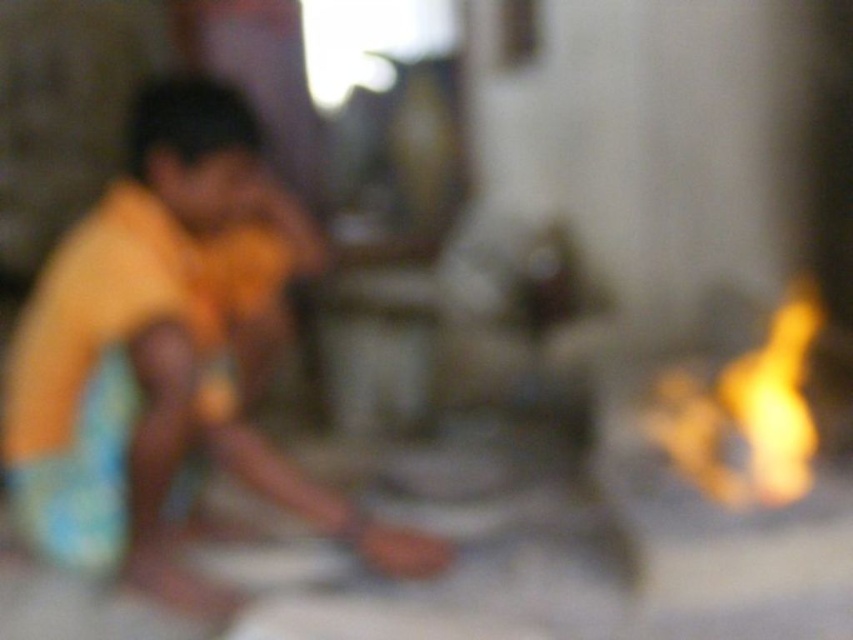
You are standing in the scene and need to locate the yellow cotton shirt at left. Based on its coordinates, where should you look relative to the center of the image?

The yellow cotton shirt at left is located at coordinates point (166, 356), which is to the left and slightly below the center of the image.